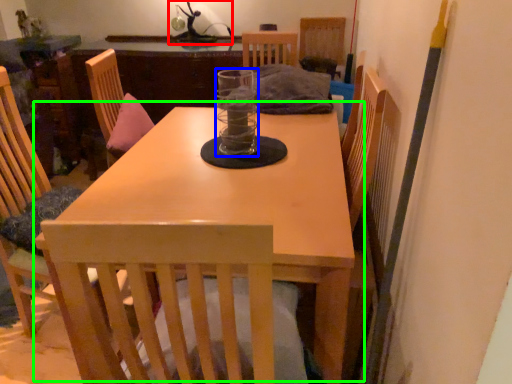
Question: Based on their relative distances, which object is nearer to table lamp (highlighted by a red box)? Choose from glass jar (highlighted by a blue box) and table (highlighted by a green box).

Choices:
 (A) glass jar
 (B) table

Answer: (A)